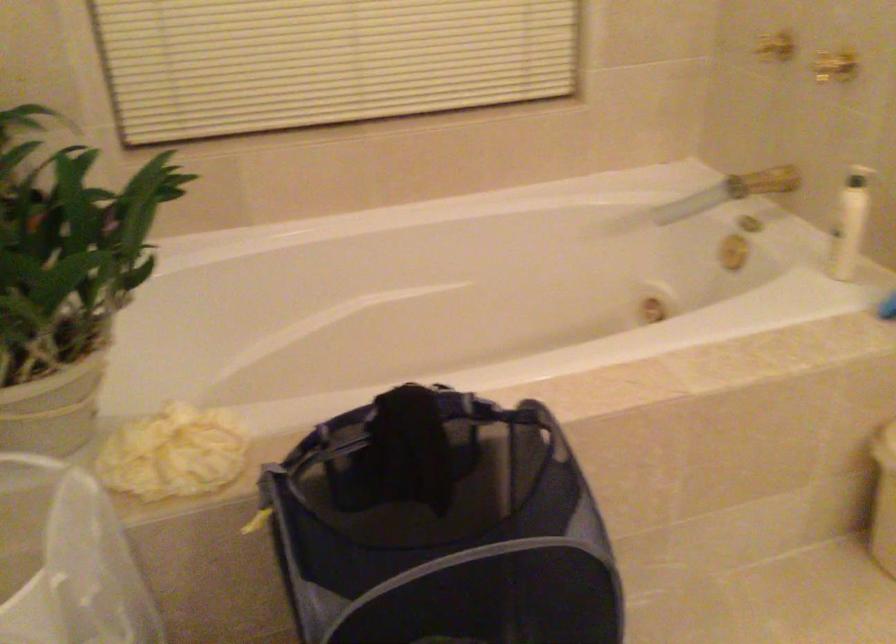
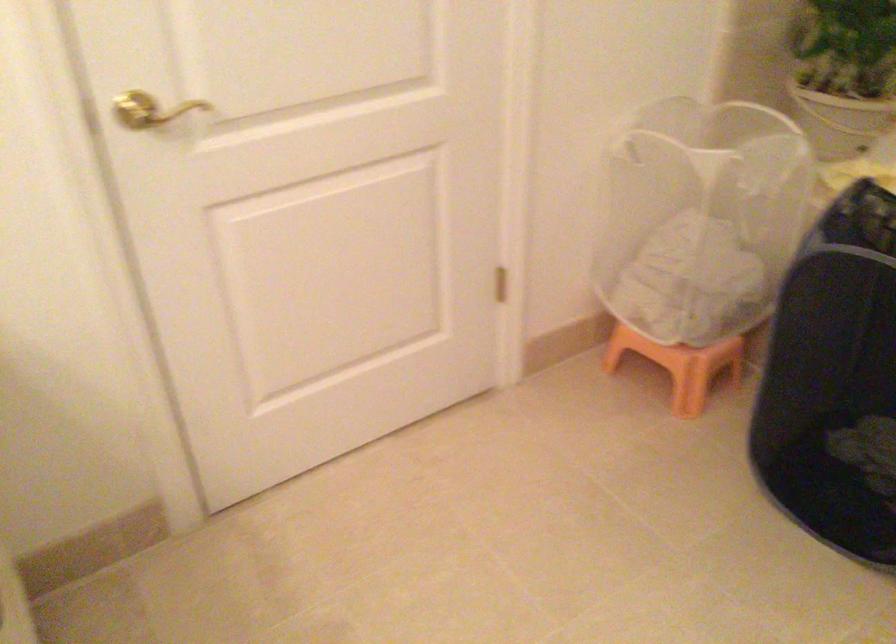
The images are taken continuously from a first-person perspective. In which direction is your viewpoint rotating?

The camera rotated toward left-down.